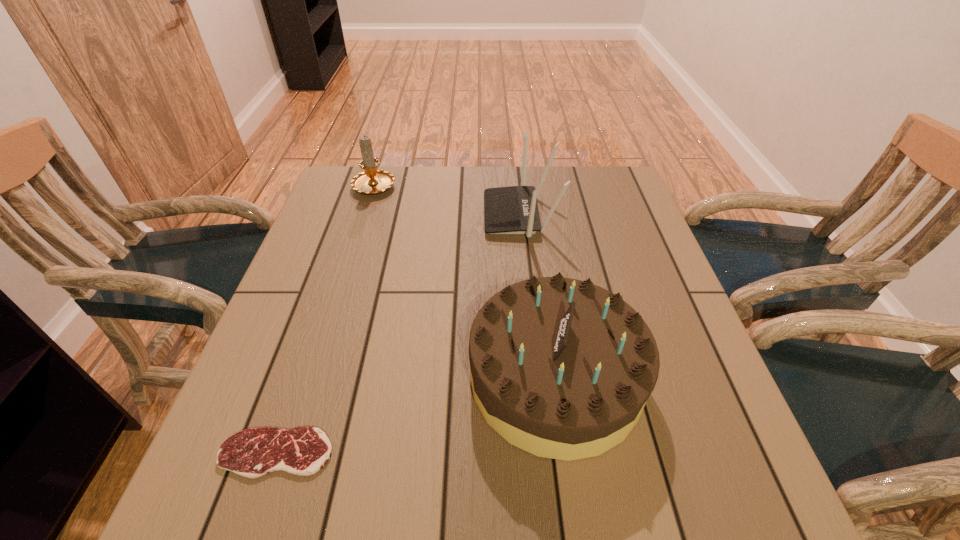
Where is `vacant area located 0.100m on the front-facing side of the birthday cake`? The image size is (960, 540). vacant area located 0.100m on the front-facing side of the birthday cake is located at coordinates (417, 378).

Where is `free space located on the right of the steak`? free space located on the right of the steak is located at coordinates (494, 453).

At what (x,y) coordinates should I click in order to perform the action: click on router located at the far edge. Please return your answer as a coordinate pair (x, y). This screenshot has height=540, width=960. Looking at the image, I should click on point(507,210).

Find the location of a particular element. The width and height of the screenshot is (960, 540). candle present at the far edge is located at coordinates (372, 181).

At what (x,y) coordinates should I click in order to perform the action: click on object present at the near edge. Please return your answer as a coordinate pair (x, y). Looking at the image, I should click on (303, 451).

You are a GUI agent. You are given a task and a screenshot of the screen. Output one action in this format:
    pyautogui.click(x=<x>, y=<y>)
    Task: Click on the candle present at the left edge
    Image resolution: width=960 pixels, height=540 pixels.
    Given the screenshot: What is the action you would take?
    pyautogui.click(x=372, y=181)

Image resolution: width=960 pixels, height=540 pixels. I want to click on steak at the left edge, so click(303, 451).

Image resolution: width=960 pixels, height=540 pixels. I want to click on object present at the right edge, so click(561, 368).

In order to click on object that is at the far left corner in this screenshot , I will do `click(372, 181)`.

Locate an element on the screen. Image resolution: width=960 pixels, height=540 pixels. object located at the near left corner is located at coordinates (303, 451).